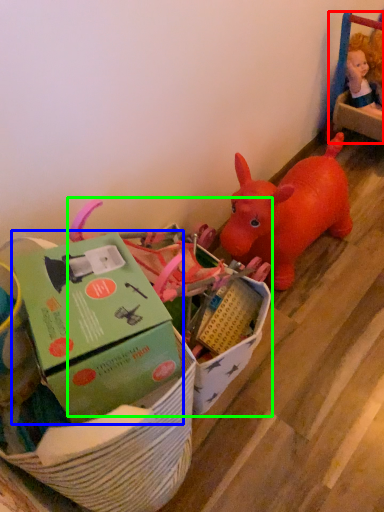
Question: Estimate the real-world distances between objects in this image. Which object is closer to toy (highlighted by a red box), box (highlighted by a blue box) or toy (highlighted by a green box)?

Choices:
 (A) box
 (B) toy

Answer: (B)